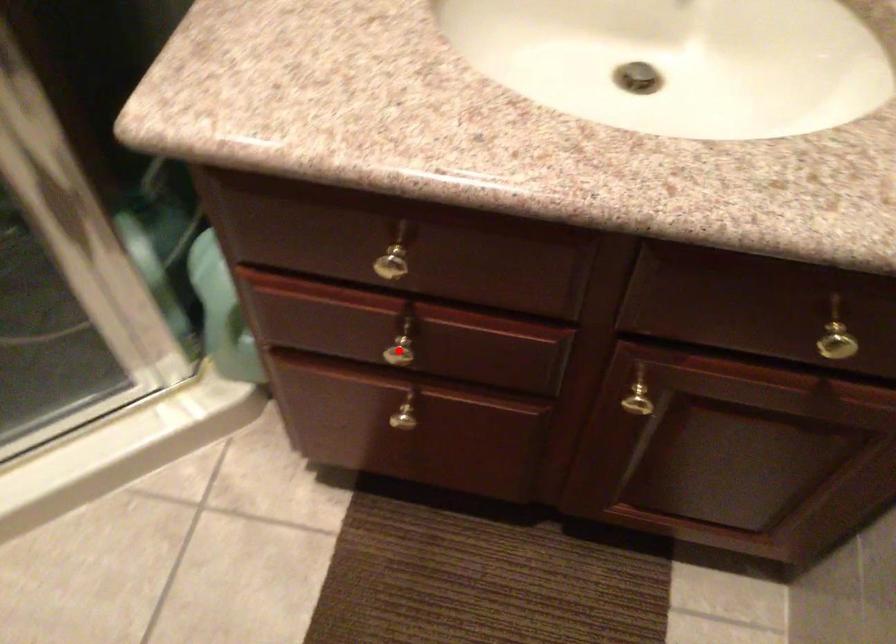
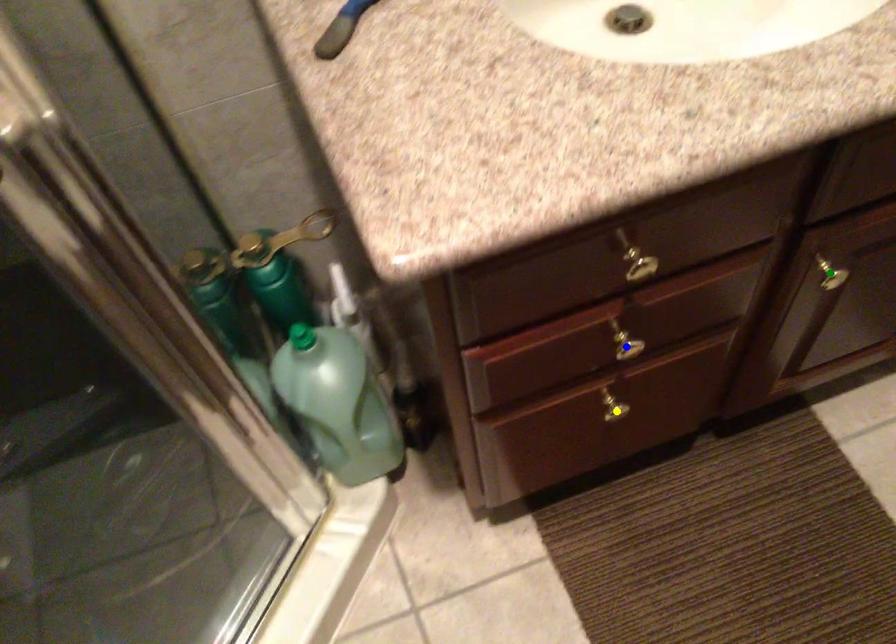
Question: I am providing you with two images of the same scene from different viewpoints. A red point is marked on the first image. You are given multiple points on the second image. Which point in image 2 is actually the same real-world point as the red point in image 1?

Choices:
 (A) blue point
 (B) yellow point
 (C) green point

Answer: (A)